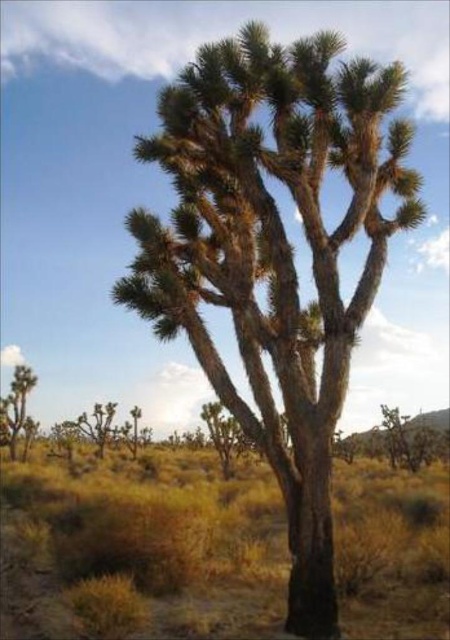
Question: Which of the following is the closest to the observer?

Choices:
 (A) brown textured tree at center
 (B) greenish-brown bark tree at center

Answer: (B)

Question: Does greenish-brown bark tree at center have a smaller size compared to green leafy bush at lower left?

Choices:
 (A) yes
 (B) no

Answer: (A)

Question: Is greenish-brown bark tree at center closer to the viewer compared to green leafy bush at lower left?

Choices:
 (A) no
 (B) yes

Answer: (B)

Question: Which object appears closest to the camera in this image?

Choices:
 (A) greenish-brown bark tree at center
 (B) brown textured bark tree at center
 (C) green leafy bush at lower left
 (D) brown textured tree at center

Answer: (A)

Question: Is brown textured bark tree at center bigger than green leafy bush at lower left?

Choices:
 (A) no
 (B) yes

Answer: (B)

Question: Which of the following is the closest to the observer?

Choices:
 (A) (211, 417)
 (B) (13, 412)

Answer: (A)